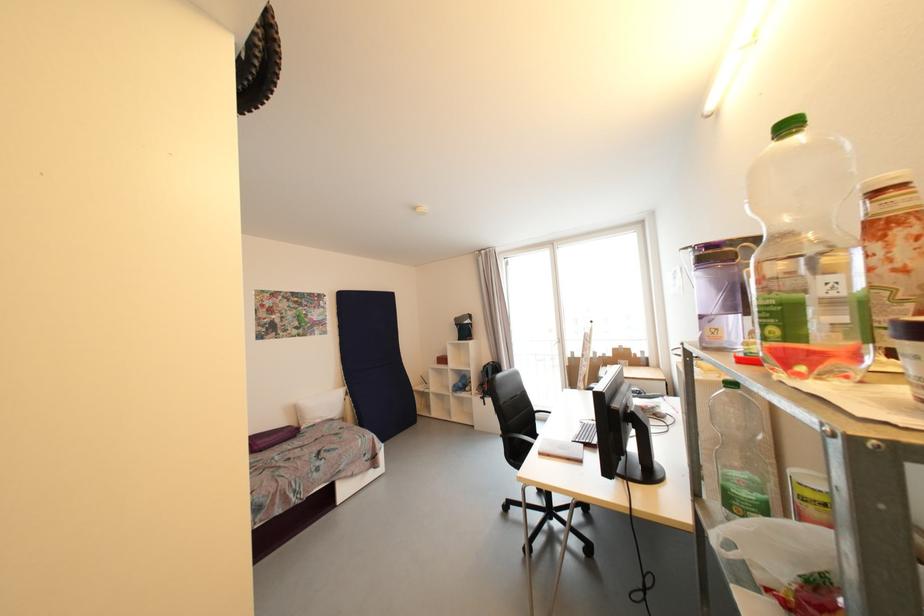
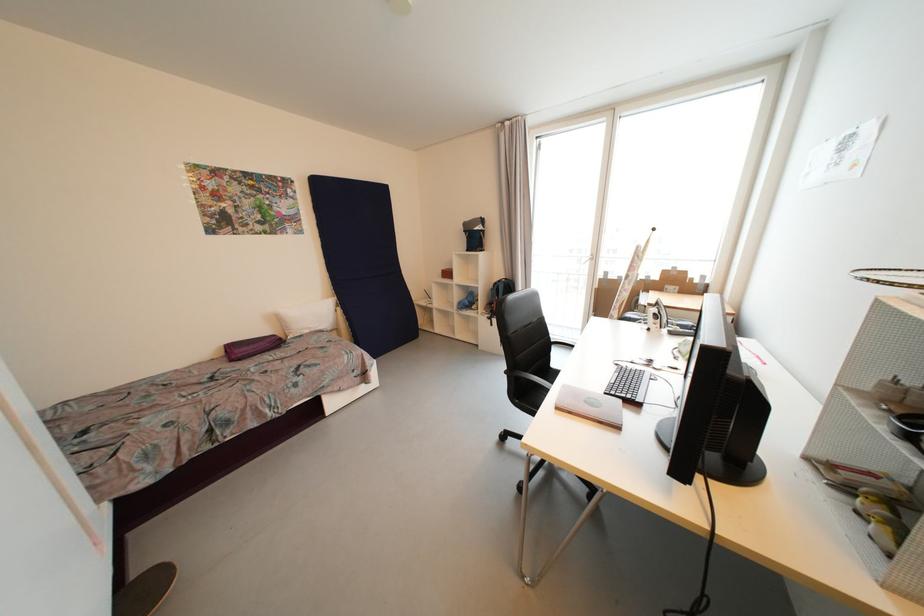
Find the pixel in the second image that matches point (544, 456) in the first image.

(562, 410)